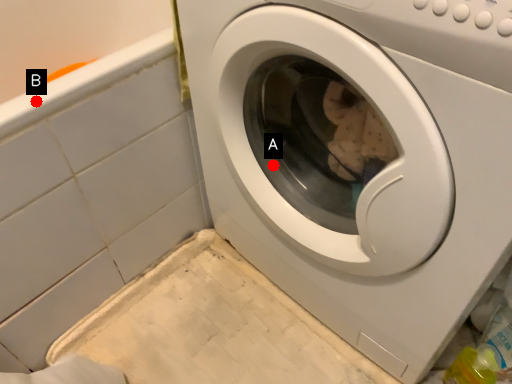
Question: Two points are circled on the image, labeled by A and B beside each circle. Which point is closer to the camera taking this photo?

Choices:
 (A) A is closer
 (B) B is closer

Answer: (B)